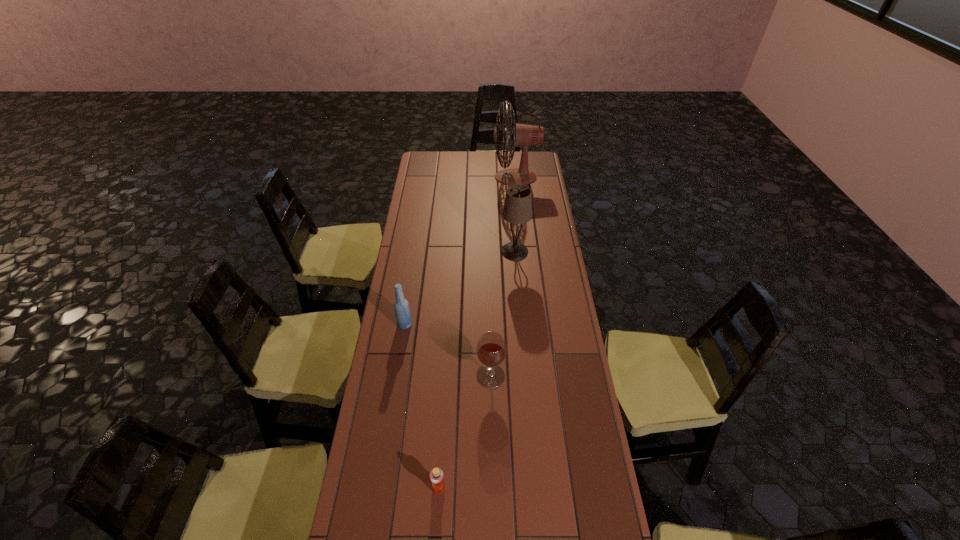
Where is `free region located 0.130m in front of the fan to direct airflow`? This screenshot has width=960, height=540. free region located 0.130m in front of the fan to direct airflow is located at coordinates (469, 177).

Where is `blank space located in front of the fan to direct airflow`? This screenshot has width=960, height=540. blank space located in front of the fan to direct airflow is located at coordinates (477, 177).

In order to click on free space located 0.370m on the front-facing side of the second farthest object in this screenshot , I will do `click(421, 251)`.

Find the location of a particular element. This screenshot has width=960, height=540. free space located on the front-facing side of the second farthest object is located at coordinates (474, 251).

This screenshot has width=960, height=540. Find the location of `blank space located 0.250m on the front-facing side of the second farthest object`. blank space located 0.250m on the front-facing side of the second farthest object is located at coordinates (446, 251).

Identify the location of vacant region located on the back of the leftmost object. (414, 265).

Where is `vacant space located on the front of the wineglass`? This screenshot has width=960, height=540. vacant space located on the front of the wineglass is located at coordinates coord(493,494).

You are a GUI agent. You are given a task and a screenshot of the screen. Output one action in this format:
    pyautogui.click(x=<x>, y=<y>)
    Task: Click on the vacant area situated 0.100m on the left of the orange juice
    
    Given the screenshot: What is the action you would take?
    pyautogui.click(x=398, y=488)

I want to click on object that is at the far edge, so click(x=521, y=135).

Locate an element on the screen. object that is positioned at the left edge is located at coordinates (402, 312).